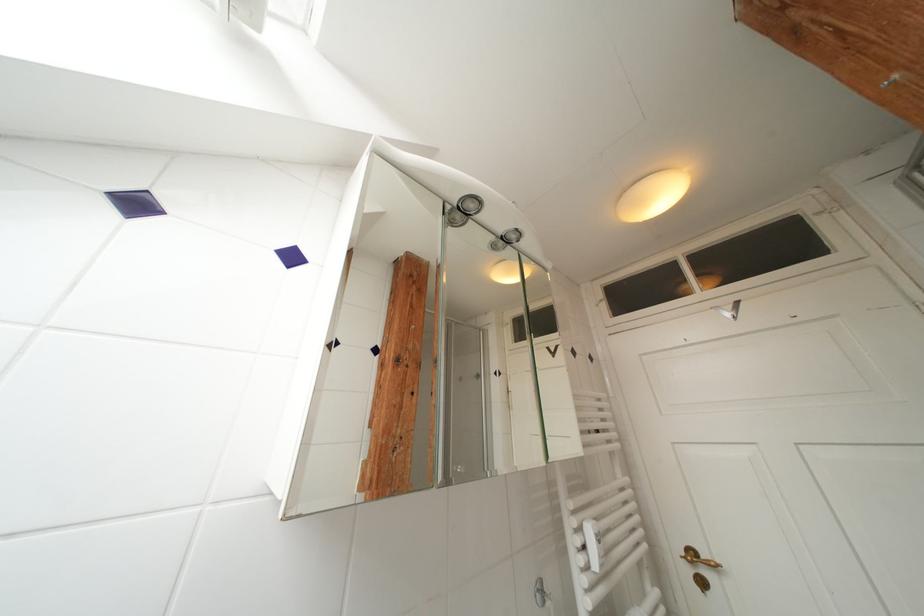
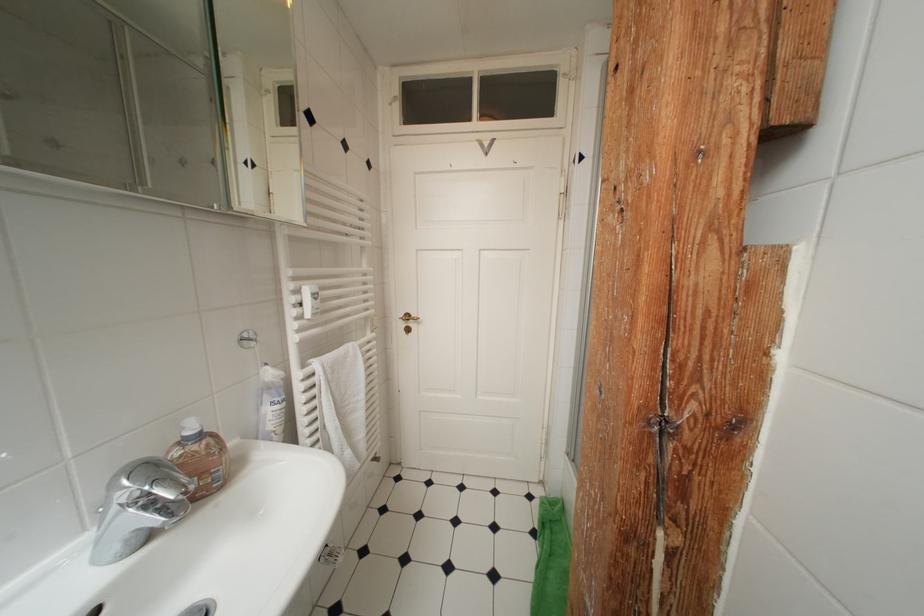
Find the pixel in the second image that matches point (502, 377) in the first image.

(253, 167)